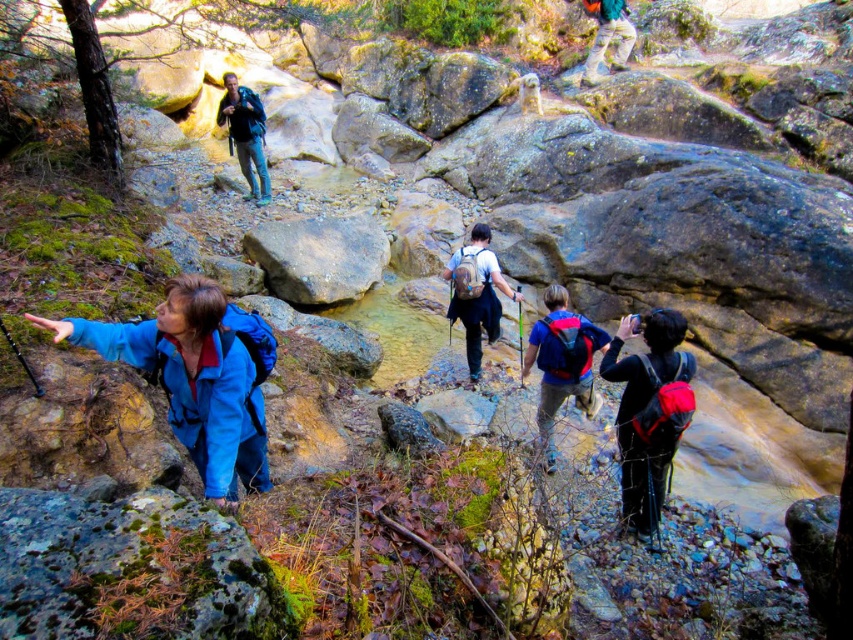
Question: Does matte black backpack at center appear over matte blue backpack at center?

Choices:
 (A) no
 (B) yes

Answer: (A)

Question: Among these objects, which one is nearest to the camera?

Choices:
 (A) matte black backpack at upper center
 (B) blue fabric jacket at lower left
 (C) matte brown backpack at center
 (D) matte blue backpack at center

Answer: (B)

Question: Estimate the real-world distances between objects in this image. Which object is farther from the matte blue backpack at center?

Choices:
 (A) matte black backpack at center
 (B) matte black backpack at upper center
 (C) matte brown backpack at center

Answer: (B)

Question: Considering the relative positions of matte black backpack at upper center and orange fabric backpack at upper center in the image provided, where is matte black backpack at upper center located with respect to orange fabric backpack at upper center?

Choices:
 (A) above
 (B) below

Answer: (B)

Question: Does matte blue backpack at center appear over orange fabric backpack at upper center?

Choices:
 (A) yes
 (B) no

Answer: (B)

Question: Which point is closer to the camera taking this photo?

Choices:
 (A) (253, 433)
 (B) (614, 10)

Answer: (A)